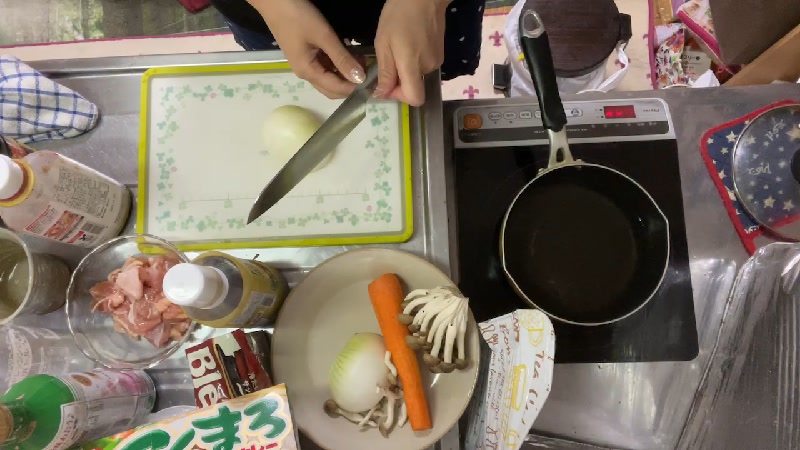
Image resolution: width=800 pixels, height=450 pixels. I want to click on cutting board, so click(x=198, y=121).